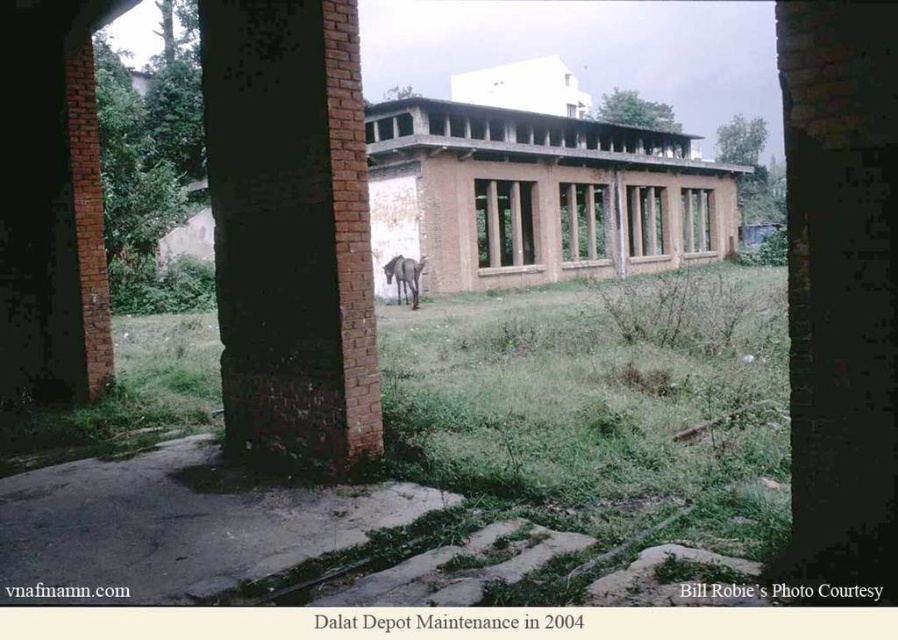
Question: Is green grass at center positioned before gray matte horse at center?

Choices:
 (A) no
 (B) yes

Answer: (B)

Question: Among these objects, which one is nearest to the camera?

Choices:
 (A) gray matte horse at center
 (B) brick at center

Answer: (B)

Question: Does green grass at center have a greater width compared to gray matte horse at center?

Choices:
 (A) yes
 (B) no

Answer: (A)

Question: Which point appears closest to the camera in this image?

Choices:
 (A) (386, 273)
 (B) (712, 276)
 (C) (292, 252)

Answer: (C)

Question: Which of these objects is positioned farthest from the brick at center?

Choices:
 (A) green grass at center
 (B) gray matte horse at center

Answer: (B)

Question: Can you confirm if green grass at center is smaller than gray matte horse at center?

Choices:
 (A) no
 (B) yes

Answer: (A)